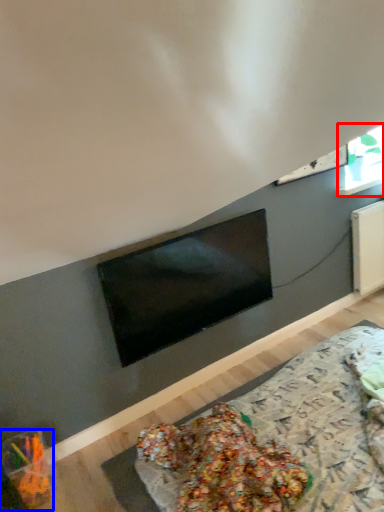
Question: Among these objects, which one is farthest to the camera, window (highlighted by a red box) or food (highlighted by a blue box)?

Choices:
 (A) window
 (B) food

Answer: (A)